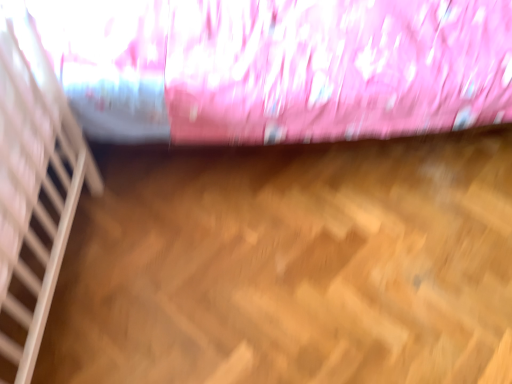
The image size is (512, 384). In order to click on vacant space in white wooden stairwell at left (from a real-world perspective) in this screenshot , I will do `click(76, 248)`.